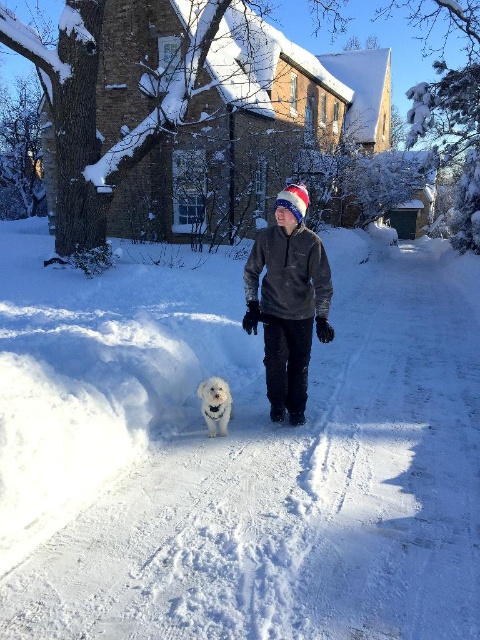
Looking at this image, you are standing on the snowdrift to the side of the road and want to take a photo of the dark gray fleece at center and the white fluffy dog at center. Which one will appear larger in your photo?

The dark gray fleece at center will appear larger in the photo because it is closer to the viewer than the white fluffy dog at center.

You are standing on the snow covered street and want to walk from point (251, 285) to point (204, 403). Which direction should you move to get closer to your destination?

You should move away from the viewer because point (251, 285) is further to the viewer than point (204, 403). Moving away from the viewer will bring you closer to the destination point.

You are a photographer trying to capture a closeup of the dark gray fleece at center and the white fluffy dog at center in the winter scene. Your camera can focus on subjects within a 50 cm range. Can you get a clear shot of both subjects without moving the camera?

The distance between dark gray fleece at center and white fluffy dog at center is 69.96 centimeters, which exceeds the camera focus range of 50 cm. Therefore, you cannot capture both subjects clearly in a single shot without moving the camera.